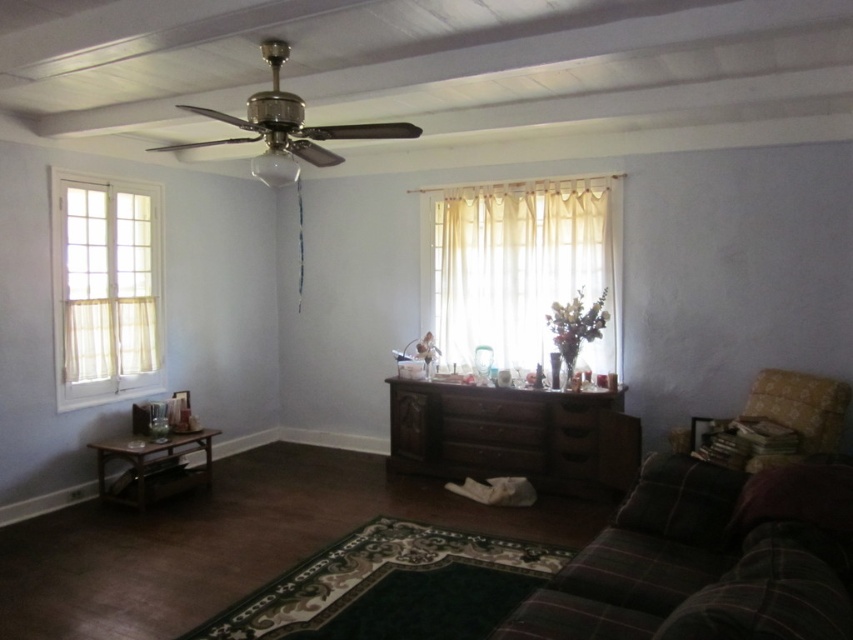
You are standing in the living room and want to take a photo of the point at coordinates (x=132, y=196). If your camera has a focal length of 50mm and you are 5.10 meters away from the point, what is the approximate distance in millimeters between the point and the center of the camera sensor?

The point at coordinates (x=132, y=196) is 5.10 meters away from the camera. Using the formula for calculating sensor distance, the distance between the point and the center of the camera sensor would be approximately 0.308 meters or 308 millimeters.